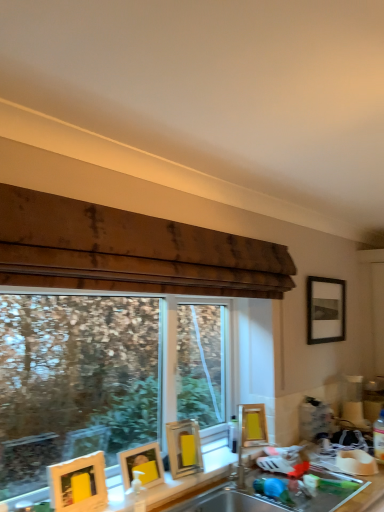
Where is `vacant area that lies in front of matte gold picture frame at lower left, placed as the second picture frame when sorted from left to right`? The height and width of the screenshot is (512, 384). vacant area that lies in front of matte gold picture frame at lower left, placed as the second picture frame when sorted from left to right is located at coordinates (136, 500).